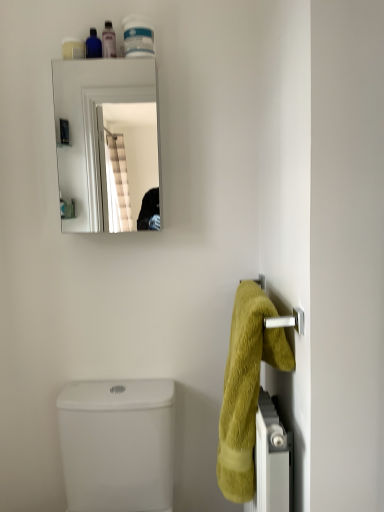
Describe the element at coordinates (73, 48) in the screenshot. I see `matte white soap at upper left, which ranks as the 4th toiletry in right-to-left order` at that location.

You are a GUI agent. You are given a task and a screenshot of the screen. Output one action in this format:
    pyautogui.click(x=<x>, y=<y>)
    Task: Click on the white glossy toilet bowl at lower left
    This screenshot has height=512, width=384.
    Given the screenshot: What is the action you would take?
    pyautogui.click(x=117, y=444)

This screenshot has width=384, height=512. What do you see at coordinates (245, 383) in the screenshot?
I see `soft yellow towel at right` at bounding box center [245, 383].

Where is `matte blue bottle at upper left, the third toiletry viewed from the right`? matte blue bottle at upper left, the third toiletry viewed from the right is located at coordinates (93, 45).

Identify the location of matte white soap at upper left, which ranks as the 4th toiletry in right-to-left order. (73, 48).

Is white glossy toilet bowl at lower left positioned with its back to clear glass mirror at upper center?

No, white glossy toilet bowl at lower left's orientation is not away from clear glass mirror at upper center.

Between white glossy toilet bowl at lower left and clear glass mirror at upper center, which one has smaller width?

With smaller width is clear glass mirror at upper center.

From a real-world perspective, is white glossy toilet bowl at lower left over clear glass mirror at upper center?

Incorrect, from a real-world perspective, white glossy toilet bowl at lower left is lower than clear glass mirror at upper center.

Between point (248, 390) and point (108, 57), which one is positioned behind?

Point (108, 57)

From their relative heights in the image, would you say soft yellow towel at right is taller or shorter than translucent plastic bottle at upper center, the 2th toiletry from the right?

Clearly, soft yellow towel at right is taller compared to translucent plastic bottle at upper center, the 2th toiletry from the right.

Is soft yellow towel at right turned away from translucent plastic bottle at upper center, the 3th toiletry viewed from the left?

No.

Does soft yellow towel at right have a smaller size compared to translucent plastic bottle at upper center, the 3th toiletry viewed from the left?

No, soft yellow towel at right is not smaller than translucent plastic bottle at upper center, the 3th toiletry viewed from the left.

The image size is (384, 512). In order to click on the 4th toiletry counting from the left side of the soft yellow towel at right in this screenshot , I will do `click(73, 48)`.

Which is behind, point (238, 417) or point (63, 39)?

The point (63, 39) is more distant.

How different are the orientations of soft yellow towel at right and matte white soap at upper left, which ranks as the 4th toiletry in right-to-left order, in degrees?

90.5 degrees.

Which of these two, soft yellow towel at right or matte white soap at upper left, marked as the 1th toiletry in a left-to-right arrangement, is wider?

soft yellow towel at right is wider.

Is matte white soap at upper left, which ranks as the 4th toiletry in right-to-left order, bigger than white glossy container at upper center, placed as the 4th toiletry when sorted from left to right?

No, matte white soap at upper left, which ranks as the 4th toiletry in right-to-left order, is not bigger than white glossy container at upper center, placed as the 4th toiletry when sorted from left to right.

Which toiletry is the 3rd one when counting from the left side of the white glossy container at upper center, which is the first toiletry from right to left? Please provide its 2D coordinates.

[(73, 48)]

Considering the relative positions of matte white soap at upper left, which ranks as the 4th toiletry in right-to-left order, and white glossy container at upper center, which is the first toiletry from right to left, in the image provided, is matte white soap at upper left, which ranks as the 4th toiletry in right-to-left order, to the right of white glossy container at upper center, which is the first toiletry from right to left, from the viewer's perspective?

Incorrect, matte white soap at upper left, which ranks as the 4th toiletry in right-to-left order, is not on the right side of white glossy container at upper center, which is the first toiletry from right to left.

Is white glossy container at upper center, which is the first toiletry from right to left, completely or partially inside matte white soap at upper left, which ranks as the 4th toiletry in right-to-left order?

No, matte white soap at upper left, which ranks as the 4th toiletry in right-to-left order, does not contain white glossy container at upper center, which is the first toiletry from right to left.

Considering their positions, is clear glass mirror at upper center located in front of or behind matte blue bottle at upper left, the third toiletry viewed from the right?

clear glass mirror at upper center is in front of matte blue bottle at upper left, the third toiletry viewed from the right.

What's the angular difference between clear glass mirror at upper center and matte blue bottle at upper left, the third toiletry viewed from the right,'s facing directions?

They differ by 0.0174 degrees in their facing directions.

Which of these two, clear glass mirror at upper center or matte blue bottle at upper left, marked as the 2th toiletry in a left-to-right arrangement, stands shorter?

matte blue bottle at upper left, marked as the 2th toiletry in a left-to-right arrangement.

In the scene shown: Is clear glass mirror at upper center oriented towards matte blue bottle at upper left, the third toiletry viewed from the right?

No, clear glass mirror at upper center is not aimed at matte blue bottle at upper left, the third toiletry viewed from the right.

From the picture: Is matte blue bottle at upper left, the third toiletry viewed from the right, wider or thinner than white glossy toilet bowl at lower left?

Considering their sizes, matte blue bottle at upper left, the third toiletry viewed from the right, looks slimmer than white glossy toilet bowl at lower left.

Considering the positions of points (89, 51) and (134, 411), is point (89, 51) closer to camera compared to point (134, 411)?

Yes, it is.

From a real-world perspective, which is physically below, matte blue bottle at upper left, the third toiletry viewed from the right, or white glossy toilet bowl at lower left?

white glossy toilet bowl at lower left.

Locate an element on the screen. The width and height of the screenshot is (384, 512). mirror in front of the translucent plastic bottle at upper center, the 3th toiletry viewed from the left is located at coordinates (x=107, y=142).

Considering the relative positions of clear glass mirror at upper center and translucent plastic bottle at upper center, the 2th toiletry from the right, in the image provided, is clear glass mirror at upper center in front of translucent plastic bottle at upper center, the 2th toiletry from the right,?

Yes, it is in front of translucent plastic bottle at upper center, the 2th toiletry from the right.

Between clear glass mirror at upper center and translucent plastic bottle at upper center, the 3th toiletry viewed from the left, which one has more height?

clear glass mirror at upper center is taller.

In the image, is clear glass mirror at upper center on the left side or the right side of translucent plastic bottle at upper center, the 2th toiletry from the right?

clear glass mirror at upper center is positioned on translucent plastic bottle at upper center, the 2th toiletry from the right,'s left side.

Locate an element on the screen. The image size is (384, 512). toilet bowl located underneath the clear glass mirror at upper center (from a real-world perspective) is located at coordinates pos(117,444).

This screenshot has width=384, height=512. Identify the location of the 4th toiletry positioned above the soft yellow towel at right (from a real-world perspective). (108, 41).

From the image, which object appears to be nearer to white glossy container at upper center, which is the first toiletry from right to left, clear glass mirror at upper center or matte white soap at upper left, marked as the 1th toiletry in a left-to-right arrangement?

Based on the image, matte white soap at upper left, marked as the 1th toiletry in a left-to-right arrangement, appears to be nearer to white glossy container at upper center, which is the first toiletry from right to left.

Based on their spatial positions, is matte white soap at upper left, which ranks as the 4th toiletry in right-to-left order, or white glossy toilet bowl at lower left closer to white glossy container at upper center, placed as the 4th toiletry when sorted from left to right?

matte white soap at upper left, which ranks as the 4th toiletry in right-to-left order, lies closer to white glossy container at upper center, placed as the 4th toiletry when sorted from left to right, than the other object.

Considering their positions, is soft yellow towel at right positioned closer to matte white soap at upper left, which ranks as the 4th toiletry in right-to-left order, than translucent plastic bottle at upper center, the 3th toiletry viewed from the left?

translucent plastic bottle at upper center, the 3th toiletry viewed from the left, is closer to matte white soap at upper left, which ranks as the 4th toiletry in right-to-left order.

Estimate the real-world distances between objects in this image. Which object is further from matte white soap at upper left, marked as the 1th toiletry in a left-to-right arrangement, soft yellow towel at right or clear glass mirror at upper center?

clear glass mirror at upper center lies further to matte white soap at upper left, marked as the 1th toiletry in a left-to-right arrangement, than the other object.

Looking at the image, which one is located further to clear glass mirror at upper center, matte blue bottle at upper left, marked as the 2th toiletry in a left-to-right arrangement, or white glossy toilet bowl at lower left?

matte blue bottle at upper left, marked as the 2th toiletry in a left-to-right arrangement, is further to clear glass mirror at upper center.

Estimate the real-world distances between objects in this image. Which object is further from translucent plastic bottle at upper center, the 2th toiletry from the right, white glossy toilet bowl at lower left or white glossy container at upper center, which is the first toiletry from right to left?

white glossy toilet bowl at lower left lies further to translucent plastic bottle at upper center, the 2th toiletry from the right, than the other object.

From the picture: Which object lies nearer to the anchor point white glossy toilet bowl at lower left, soft yellow towel at right or translucent plastic bottle at upper center, the 2th toiletry from the right?

The object closer to white glossy toilet bowl at lower left is soft yellow towel at right.

Based on their spatial positions, is soft yellow towel at right or matte blue bottle at upper left, the third toiletry viewed from the right, further from matte white soap at upper left, which ranks as the 4th toiletry in right-to-left order?

soft yellow towel at right.

What are the coordinates of `towel between translucent plastic bottle at upper center, the 3th toiletry viewed from the left, and white glossy toilet bowl at lower left, in the vertical direction` in the screenshot? It's located at (245, 383).

Find the location of a particular element. This screenshot has height=512, width=384. toiletry between white glossy container at upper center, which is the first toiletry from right to left, and white glossy toilet bowl at lower left from top to bottom is located at coordinates (73, 48).

At what (x,y) coordinates should I click in order to perform the action: click on mirror between white glossy container at upper center, placed as the 4th toiletry when sorted from left to right, and soft yellow towel at right vertically. Please return your answer as a coordinate pair (x, y). The height and width of the screenshot is (512, 384). Looking at the image, I should click on (107, 142).

Find the location of `towel between matte blue bottle at upper left, the third toiletry viewed from the right, and white glossy toilet bowl at lower left in the up-down direction`. towel between matte blue bottle at upper left, the third toiletry viewed from the right, and white glossy toilet bowl at lower left in the up-down direction is located at coordinates tap(245, 383).